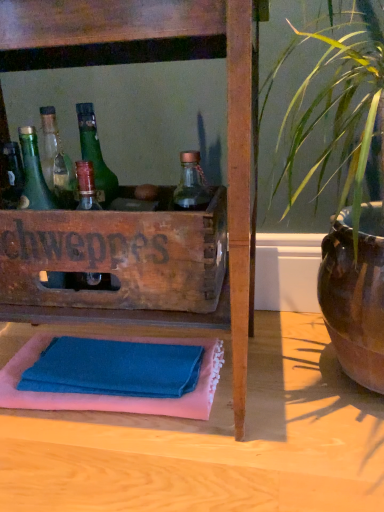
Question: Is green glass bottle at left bigger or smaller than wooden crate at center?

Choices:
 (A) big
 (B) small

Answer: (B)

Question: Visually, is green glass bottle at left positioned to the left or to the right of wooden crate at center?

Choices:
 (A) right
 (B) left

Answer: (B)

Question: Considering the real-world distances, which object is closest to the wooden crate at center?

Choices:
 (A) blue cotton bath towel at lower center
 (B) green glass bottle at left

Answer: (B)

Question: Which is nearer to the green glass bottle at left?

Choices:
 (A) blue cotton bath towel at lower center
 (B) wooden crate at center

Answer: (B)